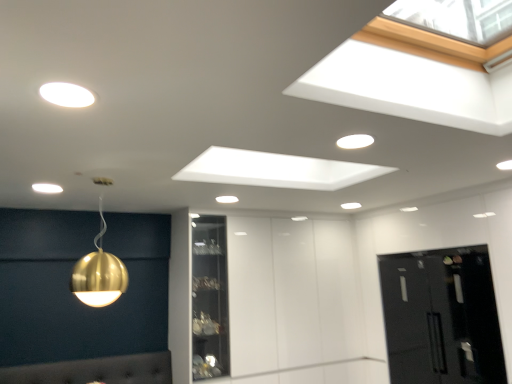
Question: From a real-world perspective, is matte gold sphere at upper left, the 3th lamp when ordered from front to back, on black glass door at lower right?

Choices:
 (A) no
 (B) yes

Answer: (B)

Question: Can you confirm if matte gold sphere at upper left, which is the 5th lamp in right-to-left order, is positioned to the right of black glass door at lower right?

Choices:
 (A) yes
 (B) no

Answer: (B)

Question: Does matte gold sphere at upper left, the 3th lamp when ordered from back to front, turn towards black glass door at lower right?

Choices:
 (A) yes
 (B) no

Answer: (B)

Question: From the image's perspective, is matte gold sphere at upper left, which is counted as the fourth lamp, starting from the bottom, on top of black glass door at lower right?

Choices:
 (A) yes
 (B) no

Answer: (A)

Question: Can you see matte gold sphere at upper left, the 3th lamp when ordered from front to back, touching black glass door at lower right?

Choices:
 (A) yes
 (B) no

Answer: (B)

Question: Does matte gold sphere at upper left, the 3th lamp when ordered from front to back, have a larger size compared to black glass door at lower right?

Choices:
 (A) yes
 (B) no

Answer: (B)

Question: Can you confirm if gold metallic sphere at upper left, the fourth lamp when ordered from back to front, is positioned to the right of matte white light fixture at upper left, which is the 5th lamp from back to front?

Choices:
 (A) no
 (B) yes

Answer: (A)

Question: Is gold metallic sphere at upper left, the 5th lamp in the top-to-bottom sequence, bigger than matte white light fixture at upper left, which is the 5th lamp from back to front?

Choices:
 (A) no
 (B) yes

Answer: (B)

Question: Is gold metallic sphere at upper left, the fourth lamp when ordered from back to front, positioned in front of matte white light fixture at upper left, acting as the 1th lamp starting from the top?

Choices:
 (A) yes
 (B) no

Answer: (B)

Question: Is gold metallic sphere at upper left, the 2th lamp when ordered from left to right, touching matte white light fixture at upper left, the fifth lamp from the bottom?

Choices:
 (A) no
 (B) yes

Answer: (A)

Question: Considering the relative sizes of gold metallic sphere at upper left, the 5th lamp in the top-to-bottom sequence, and matte white light fixture at upper left, which ranks as the third lamp in right-to-left order, in the image provided, is gold metallic sphere at upper left, the 5th lamp in the top-to-bottom sequence, wider than matte white light fixture at upper left, which ranks as the third lamp in right-to-left order,?

Choices:
 (A) yes
 (B) no

Answer: (A)

Question: From a real-world perspective, is gold metallic sphere at upper left, acting as the 2th lamp starting from the front, positioned under matte white light fixture at upper left, acting as the 1th lamp starting from the top, based on gravity?

Choices:
 (A) no
 (B) yes

Answer: (B)

Question: Is matte white light fixture at upper left, which ranks as the third lamp in right-to-left order, wider than gold metallic sphere at upper left, which is counted as the 4th lamp, starting from the right?

Choices:
 (A) yes
 (B) no

Answer: (B)